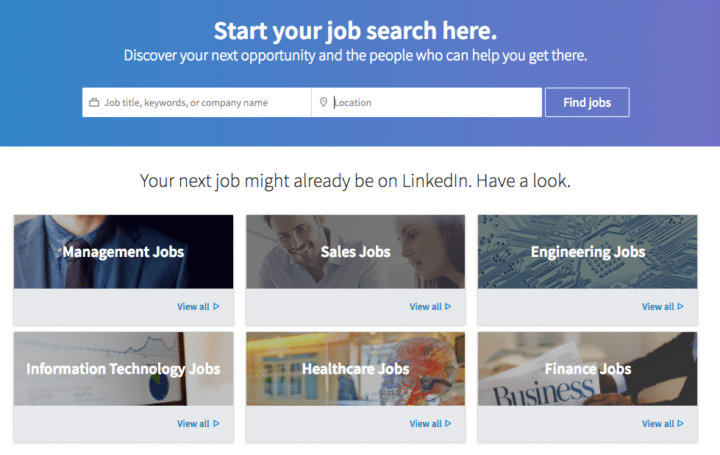
Locate an element on the screen. This screenshot has width=720, height=455. pictures is located at coordinates (552, 336), (114, 236), (132, 343), (306, 242), (312, 361), (549, 229), (557, 343).